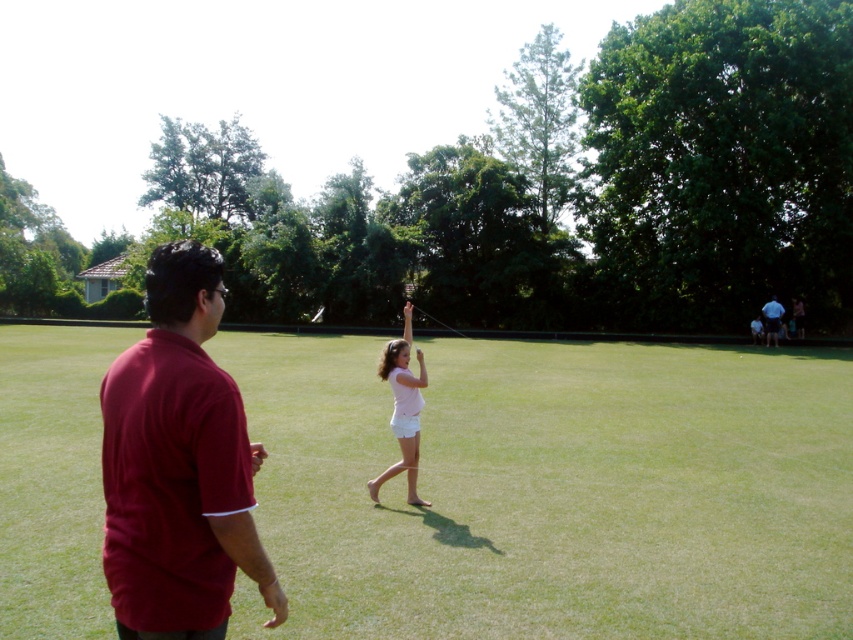
You are planning to set up a picnic blanket in the park. You see the smooth green grass at center and the maroon cotton shirt at left. Which area would you choose to place your picnic blanket and why?

The smooth green grass at center is bigger than the maroon cotton shirt at left, so you should choose the smooth green grass at center to place your picnic blanket because it offers a larger and more suitable space for the blanket.

You are standing in the park and see the smooth green grass at center and the maroon cotton shirt at left. Which object is closer to you?

The smooth green grass at center is closer to you because the maroon cotton shirt at left is behind it.